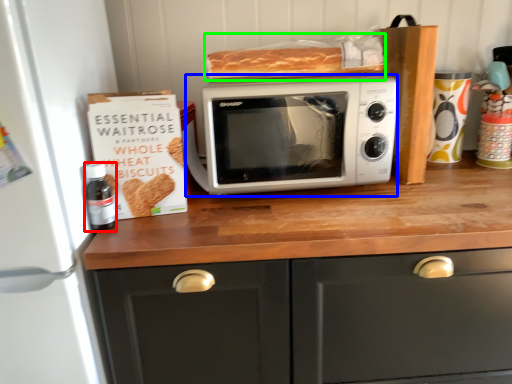
Question: Estimate the real-world distances between objects in this image. Which object is farther from bottle (highlighted by a red box), microwave oven (highlighted by a blue box) or food (highlighted by a green box)?

Choices:
 (A) microwave oven
 (B) food

Answer: (B)